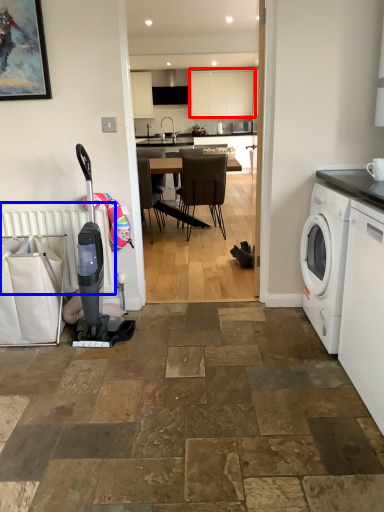
Question: Among these objects, which one is farthest to the camera, cabinetry (highlighted by a red box) or radiator (highlighted by a blue box)?

Choices:
 (A) cabinetry
 (B) radiator

Answer: (A)